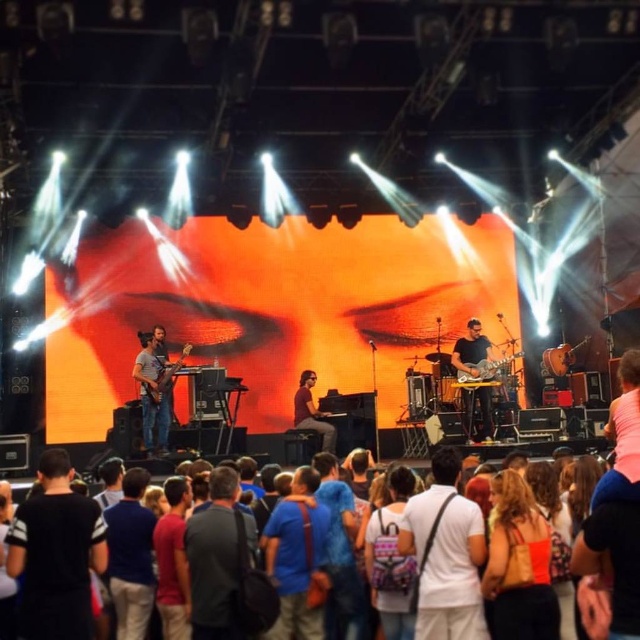
Question: Which object is the farthest from the shiny metallic guitar at left?

Choices:
 (A) multicolored fabric crowd at lower center
 (B) metallic guitar at center
 (C) matte black bass guitar at center
 (D) white fabric shirt at center

Answer: (B)

Question: In this image, where is metallic guitar at center located relative to shiny black piano at center?

Choices:
 (A) above
 (B) below

Answer: (A)

Question: Can you confirm if white fabric shirt at center is positioned to the right of multicolored fabric crowd at lower center?

Choices:
 (A) yes
 (B) no

Answer: (A)

Question: Is white fabric shirt at center further to the viewer compared to metallic guitar at center?

Choices:
 (A) yes
 (B) no

Answer: (B)

Question: Among these objects, which one is farthest from the camera?

Choices:
 (A) metallic guitar at center
 (B) multicolored fabric crowd at lower center
 (C) shiny black piano at center

Answer: (A)

Question: Based on their relative distances, which object is nearer to the shiny metallic guitar at left?

Choices:
 (A) white fabric shirt at center
 (B) multicolored fabric crowd at lower center

Answer: (B)